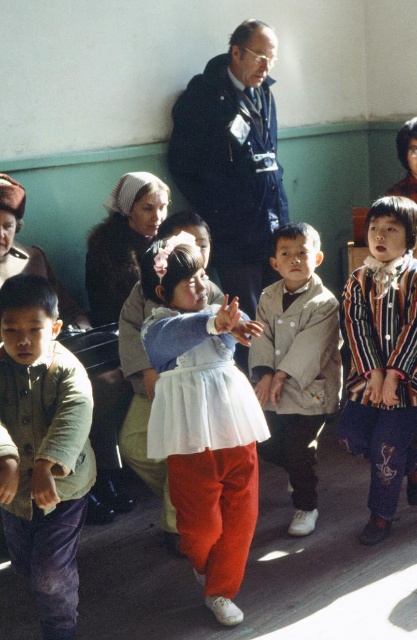
Question: Which of the following is the closest to the observer?

Choices:
 (A) coord(358,406)
 (B) coord(291,256)
 (C) coord(235,400)

Answer: (C)

Question: Does white cotton dress at center have a greater width compared to striped fabric shirt at center?

Choices:
 (A) no
 (B) yes

Answer: (B)

Question: Is matte green jacket at lower left positioned at the back of light beige fabric jacket at center?

Choices:
 (A) no
 (B) yes

Answer: (A)

Question: Can you confirm if matte green jacket at lower left is smaller than light beige fabric jacket at center?

Choices:
 (A) no
 (B) yes

Answer: (A)

Question: Which of the following is the closest to the observer?

Choices:
 (A) matte green jacket at lower left
 (B) white cotton dress at center
 (C) striped fabric shirt at center

Answer: (A)

Question: Estimate the real-world distances between objects in this image. Which object is farther from the striped fabric shirt at center?

Choices:
 (A) dark blue jacket at upper center
 (B) light beige fabric jacket at center

Answer: (A)